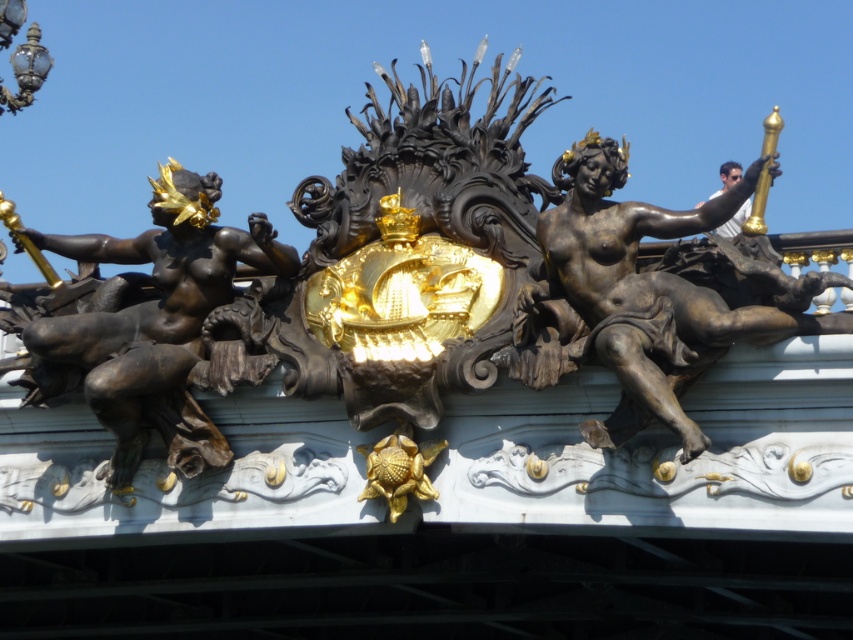
Question: Can you confirm if bronze statue at left is smaller than bronze statue at right?

Choices:
 (A) yes
 (B) no

Answer: (B)

Question: Which point is farther to the camera?

Choices:
 (A) pos(280,252)
 (B) pos(735,316)

Answer: (A)

Question: Does bronze statue at left come in front of bronze statue at right?

Choices:
 (A) yes
 (B) no

Answer: (B)

Question: From the image, what is the correct spatial relationship of bronze statue at left in relation to bronze statue at right?

Choices:
 (A) right
 (B) left

Answer: (B)